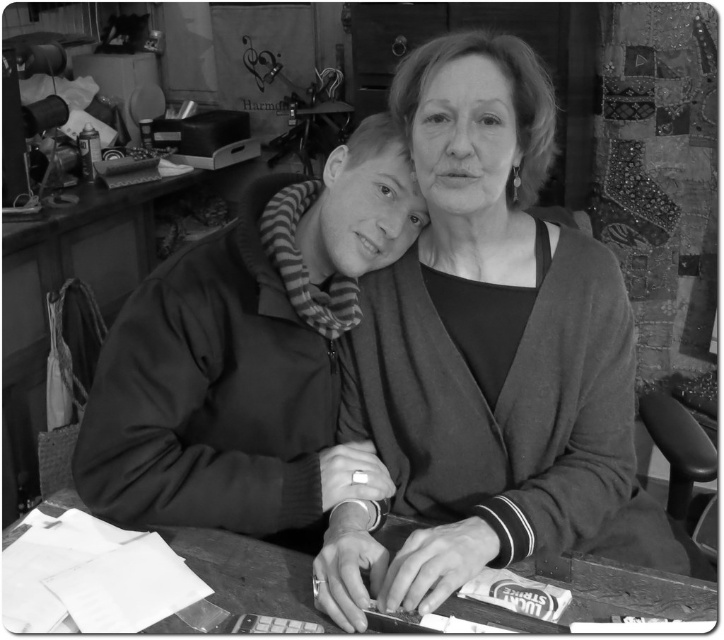
Does matte gray sweater at center appear on the right side of wooden table at lower center?

Yes, matte gray sweater at center is to the right of wooden table at lower center.

Which is in front, point (400, 413) or point (681, 608)?

Point (681, 608) is more forward.

Measure the distance between point (572, 339) and camera.

Point (572, 339) and camera are 1.09 meters apart from each other.

Locate an element on the screen. This screenshot has width=724, height=640. matte gray sweater at center is located at coordinates (487, 356).

Consider the image. Which is below, matte gray sweater at center or matte black jacket at center?

matte black jacket at center is lower down.

The image size is (724, 640). What do you see at coordinates (487, 356) in the screenshot?
I see `matte gray sweater at center` at bounding box center [487, 356].

Image resolution: width=724 pixels, height=640 pixels. What are the coordinates of `matte gray sweater at center` in the screenshot? It's located at (487, 356).

Does matte black jacket at center have a greater height compared to wooden table at lower center?

Yes, matte black jacket at center is taller than wooden table at lower center.

Does matte black jacket at center have a smaller size compared to wooden table at lower center?

Actually, matte black jacket at center might be larger than wooden table at lower center.

The image size is (724, 640). I want to click on matte black jacket at center, so click(x=248, y=353).

Identify the location of matte black jacket at center. (248, 353).